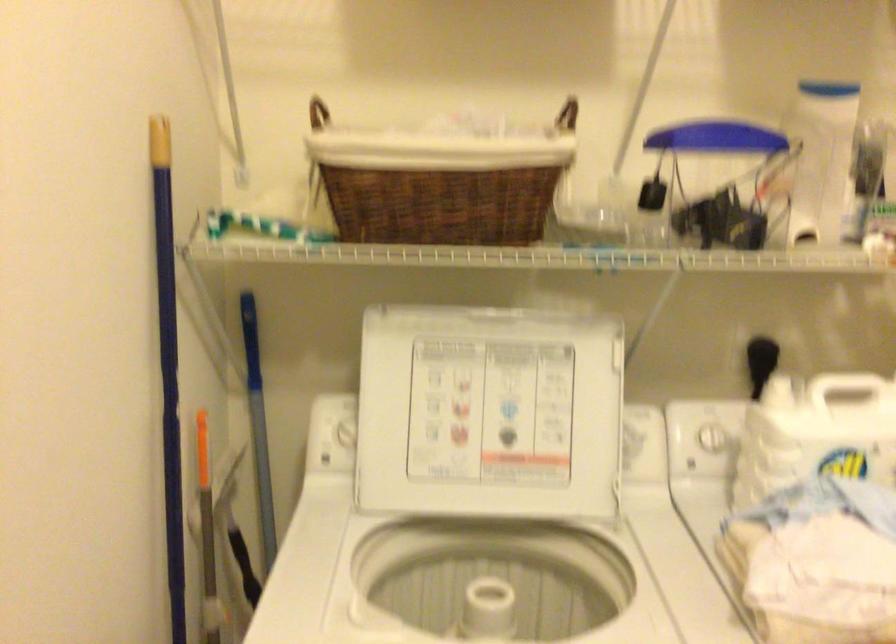
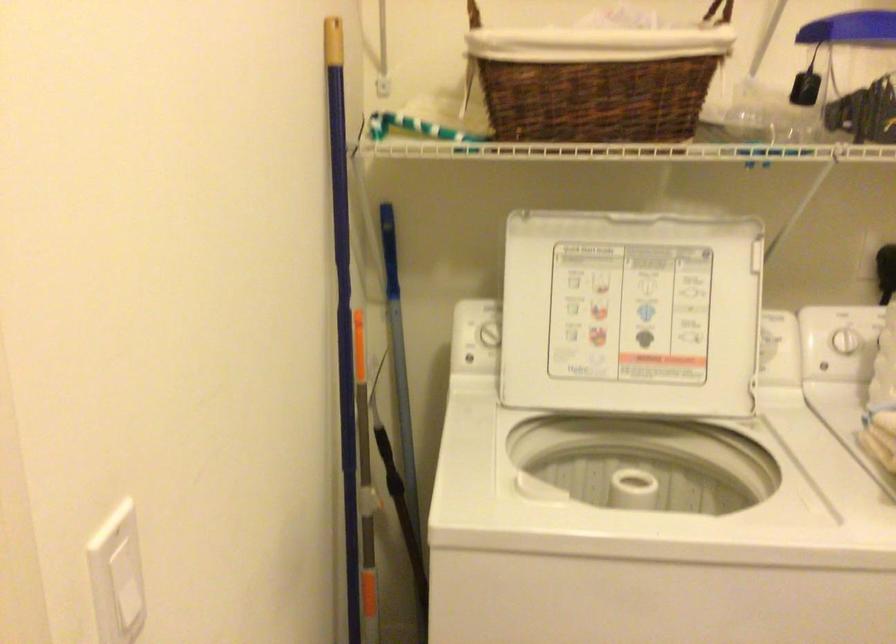
In the second image, find the point that corresponds to point 490,413 in the first image.

(631, 313)